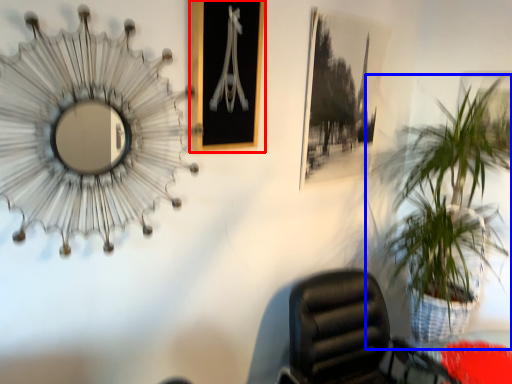
Question: Which point is further to the camera, picture frame (highlighted by a red box) or houseplant (highlighted by a blue box)?

Choices:
 (A) picture frame
 (B) houseplant

Answer: (B)